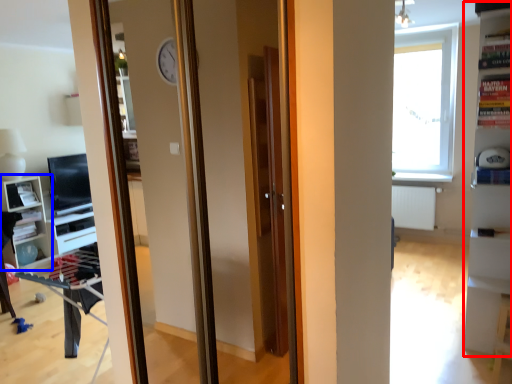
Question: Which point is closer to the camera, bookshelf (highlighted by a red box) or shelf (highlighted by a blue box)?

Choices:
 (A) bookshelf
 (B) shelf

Answer: (A)